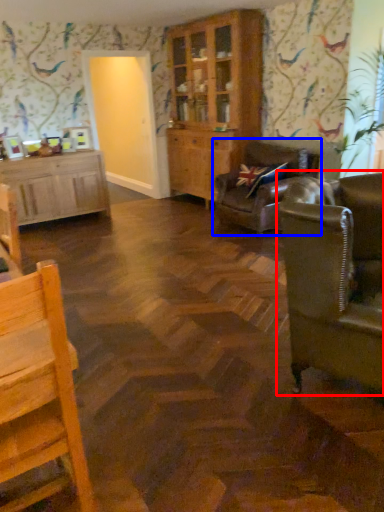
Question: Among these objects, which one is nearest to the camera, studio couch (highlighted by a red box) or studio couch (highlighted by a blue box)?

Choices:
 (A) studio couch
 (B) studio couch

Answer: (A)